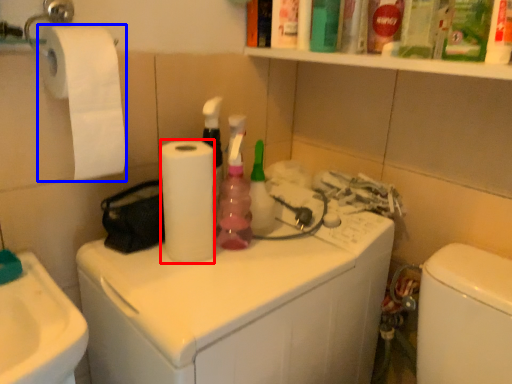
Question: Which object appears closest to the camera in this image, paper towel (highlighted by a red box) or toilet paper (highlighted by a blue box)?

Choices:
 (A) paper towel
 (B) toilet paper

Answer: (B)